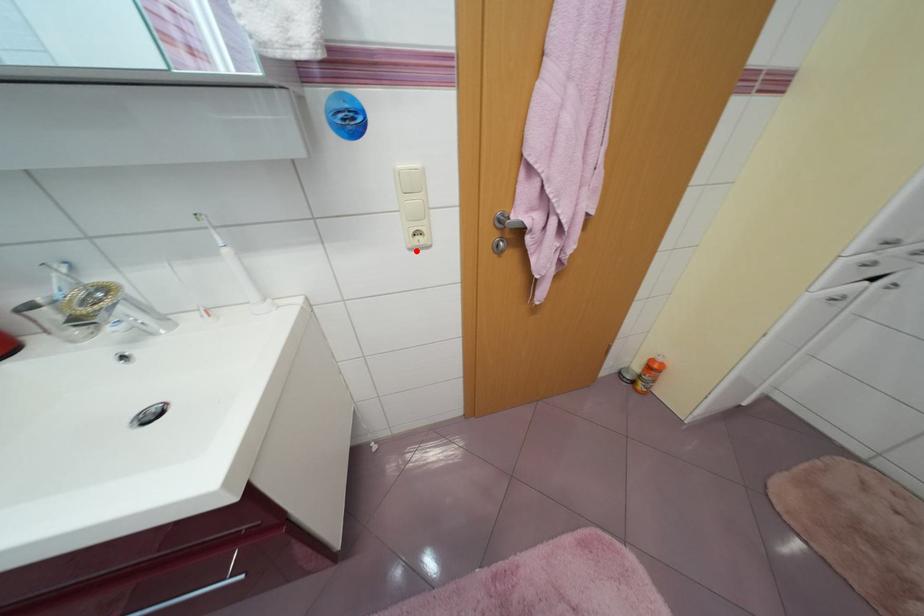
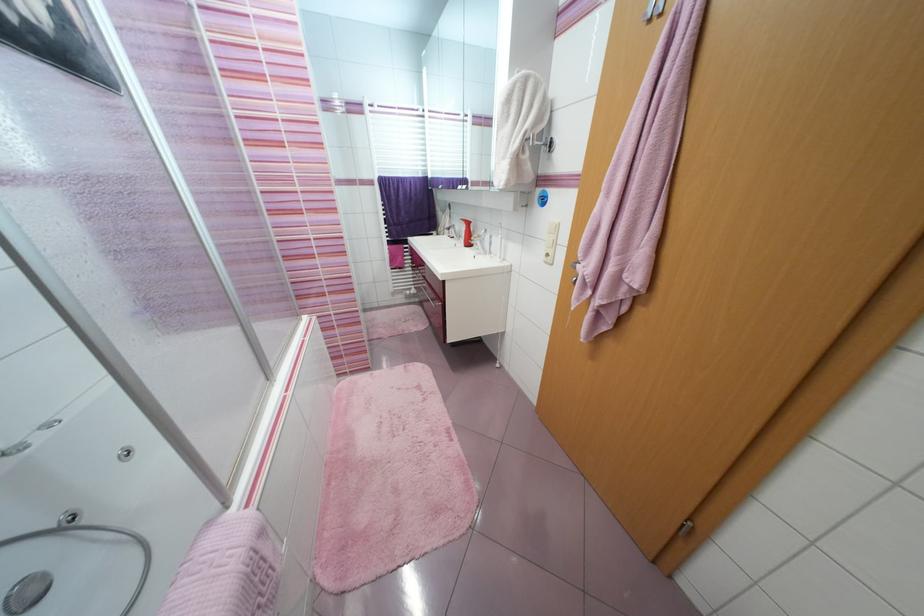
Find the pixel in the second image that matches the highlighted location in the first image.

(551, 264)